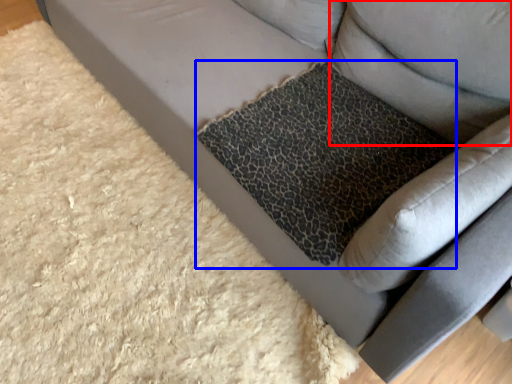
Question: Which point is further to the camera, pillow (highlighted by a red box) or cat bed (highlighted by a blue box)?

Choices:
 (A) pillow
 (B) cat bed

Answer: (B)